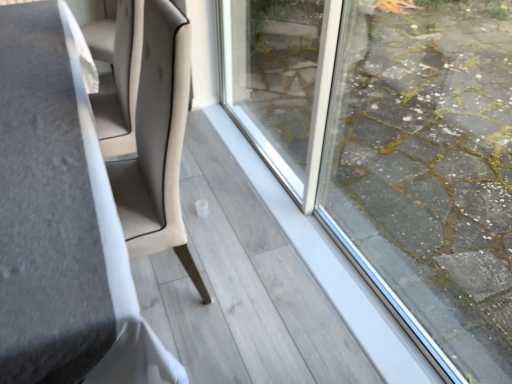
What do you see at coordinates (61, 223) in the screenshot? I see `velvet gray tablecloth at left` at bounding box center [61, 223].

Where is `velvet gray tablecloth at left`? velvet gray tablecloth at left is located at coordinates (61, 223).

What are the coordinates of `velvet gray tablecloth at left` in the screenshot? It's located at (61, 223).